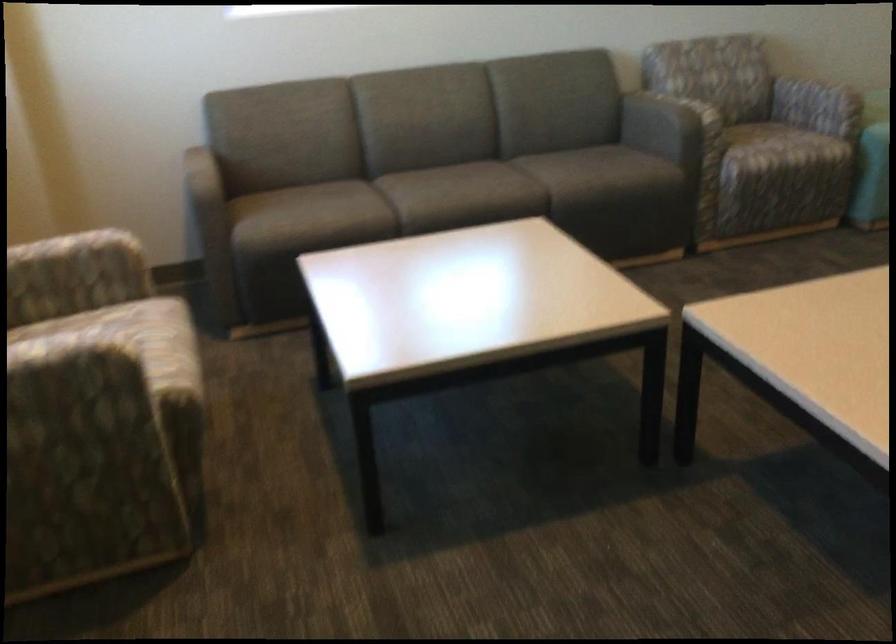
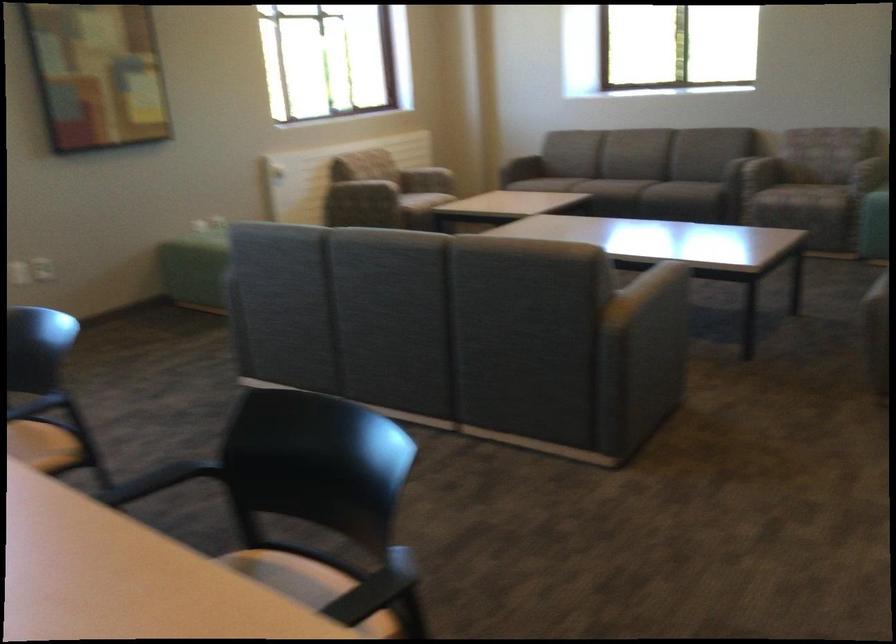
The point at (303, 203) is marked in the first image. Where is the corresponding point in the second image?

(522, 167)